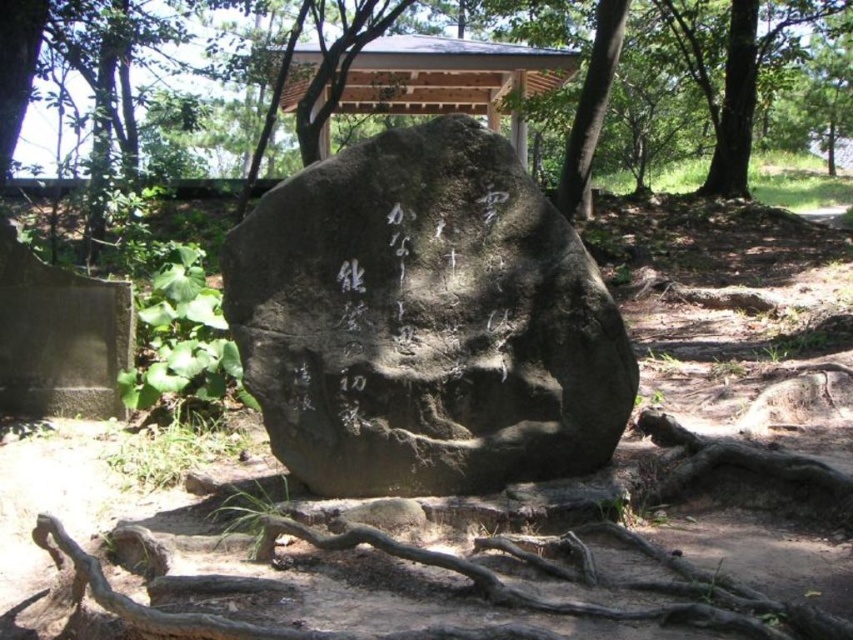
Can you confirm if dark gray stone at center is positioned above brown rough tree roots at lower center?

Yes, dark gray stone at center is above brown rough tree roots at lower center.

Is dark gray stone at center to the right of brown rough tree roots at lower center from the viewer's perspective?

In fact, dark gray stone at center is to the left of brown rough tree roots at lower center.

At what (x,y) coordinates should I click in order to perform the action: click on dark gray stone at center. Please return your answer as a coordinate pair (x, y). Looking at the image, I should click on (424, 321).

Identify the location of dark gray stone at center. (424, 321).

Which is above, green leafy tree at center or brown rough tree roots at lower center?

green leafy tree at center

Is point (10, 29) more distant than point (711, 624)?

That is True.

Who is more forward, (695, 16) or (527, 634)?

Positioned in front is point (527, 634).

Locate an element on the screen. The height and width of the screenshot is (640, 853). green leafy tree at center is located at coordinates (654, 100).

Is point (276, 195) behind point (639, 168)?

No, (276, 195) is closer to viewer.

Consider the image. Which of these two, dark gray stone at center or green leafy tree at center, stands taller?

green leafy tree at center is taller.

What do you see at coordinates (424, 321) in the screenshot? I see `dark gray stone at center` at bounding box center [424, 321].

In order to click on dark gray stone at center in this screenshot , I will do `click(424, 321)`.